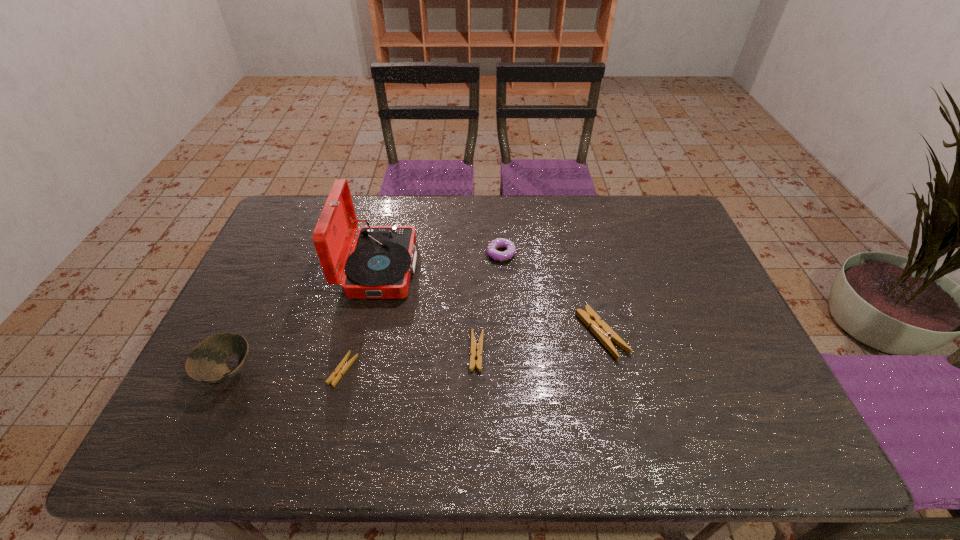
Find the location of a particular element. This screenshot has width=960, height=540. the leftmost clothespin is located at coordinates (343, 366).

Where is `the shortest clothespin`? This screenshot has width=960, height=540. the shortest clothespin is located at coordinates (343, 366).

Locate an element on the screen. This screenshot has height=540, width=960. the second shortest clothespin is located at coordinates (474, 343).

Identify the location of the fifth tallest object. This screenshot has height=540, width=960. (474, 343).

At what (x,y) coordinates should I click in order to perform the action: click on the fourth tallest object. Please return your answer as a coordinate pair (x, y). Looking at the image, I should click on (588, 316).

The height and width of the screenshot is (540, 960). What are the coordinates of `the tallest clothespin` in the screenshot? It's located at (588, 316).

Where is `doughnut`? The width and height of the screenshot is (960, 540). doughnut is located at coordinates (496, 255).

Identify the location of the fourth shortest object. This screenshot has height=540, width=960. (496, 255).

Locate an element on the screen. phonograph_record is located at coordinates (382, 258).

Identify the location of the second tallest object. (206, 363).